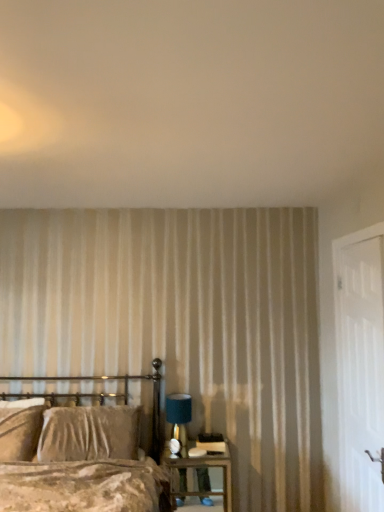
At what (x,y) coordinates should I click in order to perform the action: click on teal fabric lampshade at right. Please return your answer as a coordinate pair (x, y). Image resolution: width=384 pixels, height=512 pixels. Looking at the image, I should click on (178, 414).

Measure the distance between point (x=97, y=413) and camera.

Point (x=97, y=413) and camera are 2.89 meters apart from each other.

This screenshot has width=384, height=512. I want to click on wooden nightstand at lower right, so click(x=202, y=470).

Image resolution: width=384 pixels, height=512 pixels. What do you see at coordinates (89, 433) in the screenshot?
I see `velvet beige pillow at left` at bounding box center [89, 433].

Locate an element on the screen. The width and height of the screenshot is (384, 512). teal fabric lampshade at right is located at coordinates (178, 414).

This screenshot has width=384, height=512. I want to click on pillow located above the wooden nightstand at lower right (from the image's perspective), so click(89, 433).

Which object is thinner, velvet beige pillow at left or wooden nightstand at lower right?

velvet beige pillow at left is thinner.

Is velvet beige pillow at left positioned beyond the bounds of wooden nightstand at lower right?

Yes, velvet beige pillow at left is outside of wooden nightstand at lower right.

From the picture: From a real-world perspective, is velvet beige pillow at left physically located above or below wooden nightstand at lower right?

Clearly, from a real-world perspective, velvet beige pillow at left is above wooden nightstand at lower right.

Between wooden nightstand at lower right and velvet brown bed at lower left, which one is positioned behind?

wooden nightstand at lower right is further from the camera.

Based on the photo, can you confirm if wooden nightstand at lower right is shorter than velvet brown bed at lower left?

Yes.

Looking at this image, based on their sizes in the image, would you say wooden nightstand at lower right is bigger or smaller than velvet brown bed at lower left?

In the image, wooden nightstand at lower right appears to be smaller than velvet brown bed at lower left.

Image resolution: width=384 pixels, height=512 pixels. I want to click on nightstand beneath the velvet brown bed at lower left (from a real-world perspective), so click(x=202, y=470).

Is white textured wall at upper center further to camera compared to velvet brown bed at lower left?

Yes, the depth of white textured wall at upper center is greater than that of velvet brown bed at lower left.

Are white textured wall at upper center and velvet brown bed at lower left located far from each other?

white textured wall at upper center is positioned a significant distance from velvet brown bed at lower left.

Is velvet brown bed at lower left at the back of white textured wall at upper center?

No, velvet brown bed at lower left is not at the back of white textured wall at upper center.

From a real-world perspective, is teal fabric lampshade at right located higher than velvet beige pillow at left?

Indeed, from a real-world perspective, teal fabric lampshade at right stands above velvet beige pillow at left.

Considering the positions of objects teal fabric lampshade at right and velvet beige pillow at left in the image provided, who is more to the left, teal fabric lampshade at right or velvet beige pillow at left?

velvet beige pillow at left is more to the left.

Looking at their sizes, would you say teal fabric lampshade at right is wider or thinner than velvet beige pillow at left?

In the image, teal fabric lampshade at right appears to be more narrow than velvet beige pillow at left.

From the image's perspective, is teal fabric lampshade at right above or below velvet beige pillow at left?

Clearly, from the image's perspective, teal fabric lampshade at right is above velvet beige pillow at left.

Can you confirm if teal fabric lampshade at right is shorter than white textured wall at upper center?

Incorrect, the height of teal fabric lampshade at right does not fall short of that of white textured wall at upper center.

Does point (191, 401) come farther from viewer compared to point (81, 206)?

That is False.

Is the position of teal fabric lampshade at right more distant than that of white textured wall at upper center?

That is True.

From a real-world perspective, between teal fabric lampshade at right and white textured wall at upper center, who is vertically lower?

From a 3D spatial view, teal fabric lampshade at right is below.

Is wooden nightstand at lower right touching white wooden door at right?

No, wooden nightstand at lower right is not making contact with white wooden door at right.

Between wooden nightstand at lower right and white wooden door at right, which one is positioned in front?

white wooden door at right is closer to the camera.

In terms of height, does wooden nightstand at lower right look taller or shorter compared to white wooden door at right?

wooden nightstand at lower right is shorter than white wooden door at right.

Which of these two, wooden nightstand at lower right or velvet beige pillow at left, is smaller?

wooden nightstand at lower right is smaller.

Is wooden nightstand at lower right aimed at velvet beige pillow at left?

No, wooden nightstand at lower right is not facing towards velvet beige pillow at left.

From a real-world perspective, which object rests below the other?

wooden nightstand at lower right, from a real-world perspective.

Who is more distant, wooden nightstand at lower right or velvet beige pillow at left?

velvet beige pillow at left is further from the camera.

Where is `pillow on the left of wooden nightstand at lower right`? This screenshot has height=512, width=384. pillow on the left of wooden nightstand at lower right is located at coordinates (89, 433).

Locate an element on the screen. This screenshot has width=384, height=512. nightstand on the right of velvet brown bed at lower left is located at coordinates (202, 470).

Looking at the image, which one is located further to velvet beige pillow at left, teal fabric lampshade at right or velvet brown bed at lower left?

teal fabric lampshade at right.

From the image, which object appears to be farther from white textured wall at upper center, white wooden door at right or velvet beige pillow at left?

velvet beige pillow at left.

Based on their spatial positions, is velvet beige pillow at left or white wooden door at right further from teal fabric lampshade at right?

white wooden door at right lies further to teal fabric lampshade at right than the other object.

Which object lies further to the anchor point velvet brown bed at lower left, teal fabric lampshade at right or white wooden door at right?

white wooden door at right lies further to velvet brown bed at lower left than the other object.

Looking at the image, which one is located closer to white wooden door at right, white textured wall at upper center or velvet brown bed at lower left?

white textured wall at upper center is positioned closer to the anchor white wooden door at right.

Looking at the image, which one is located closer to white textured wall at upper center, wooden nightstand at lower right or velvet brown bed at lower left?

The object closer to white textured wall at upper center is velvet brown bed at lower left.

When comparing their distances from white textured wall at upper center, does teal fabric lampshade at right or wooden nightstand at lower right seem further?

wooden nightstand at lower right is positioned further to the anchor white textured wall at upper center.

Looking at this image, considering their positions, is velvet brown bed at lower left positioned further to teal fabric lampshade at right than white textured wall at upper center?

Based on the image, white textured wall at upper center appears to be further to teal fabric lampshade at right.

Where is `screen door between white textured wall at upper center and teal fabric lampshade at right from front to back`? screen door between white textured wall at upper center and teal fabric lampshade at right from front to back is located at coordinates (360, 365).

Image resolution: width=384 pixels, height=512 pixels. Find the location of `table lamp between white textured wall at upper center and wooden nightstand at lower right from top to bottom`. table lamp between white textured wall at upper center and wooden nightstand at lower right from top to bottom is located at coordinates coord(178,414).

Find the location of a particular element. screen door positioned between white textured wall at upper center and velvet beige pillow at left from near to far is located at coordinates (360, 365).

Where is `nightstand situated between velvet beige pillow at left and white wooden door at right from left to right`? This screenshot has height=512, width=384. nightstand situated between velvet beige pillow at left and white wooden door at right from left to right is located at coordinates (202, 470).